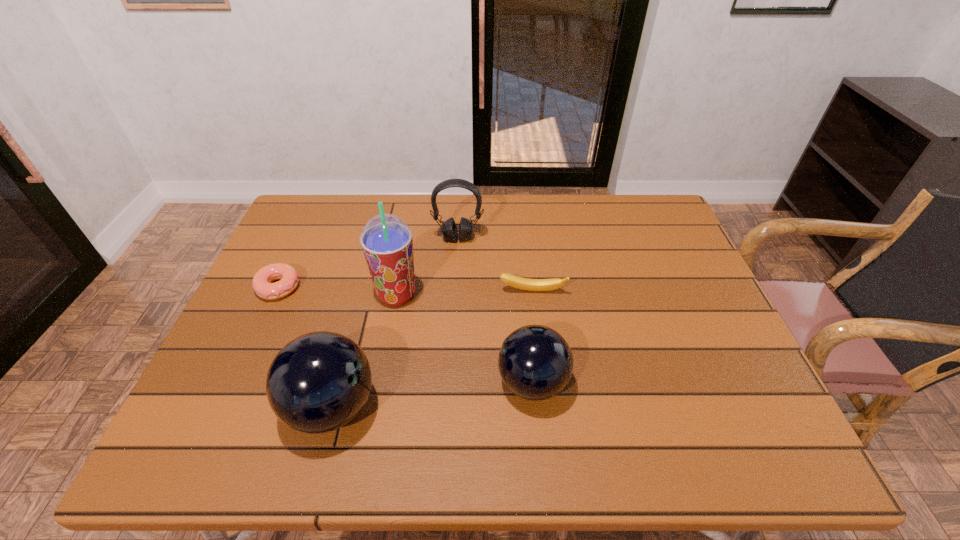
In order to click on vacant position located 0.330m on the side of the shorter bowling ball with the finger holes in this screenshot , I will do (351, 383).

Locate an element on the screen. The width and height of the screenshot is (960, 540). free location located 0.080m on the side of the shorter bowling ball with the finger holes is located at coordinates (462, 383).

Locate an element on the screen. The width and height of the screenshot is (960, 540). free space located 0.350m on the side of the shorter bowling ball with the finger holes is located at coordinates (342, 383).

Where is `free space located on the front-facing side of the farthest object`? Image resolution: width=960 pixels, height=540 pixels. free space located on the front-facing side of the farthest object is located at coordinates (452, 341).

Identify the location of vacant space located on the back of the smoothie. (408, 234).

Locate an element on the screen. Image resolution: width=960 pixels, height=540 pixels. free point located on the front of the doughnut is located at coordinates (249, 353).

Identify the location of blank space located at the stem of the banana. This screenshot has width=960, height=540. (543, 383).

Locate an element on the screen. object positioned at the far edge is located at coordinates (449, 229).

This screenshot has height=540, width=960. In order to click on object situated at the left edge in this screenshot , I will do `click(289, 278)`.

Where is `vacant space at the far edge of the desktop`? The height and width of the screenshot is (540, 960). vacant space at the far edge of the desktop is located at coordinates (541, 228).